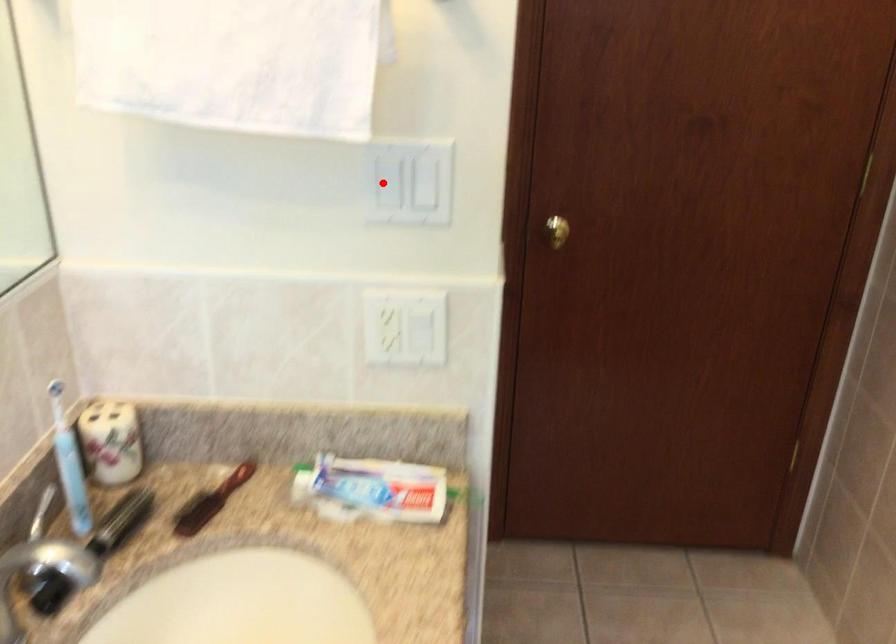
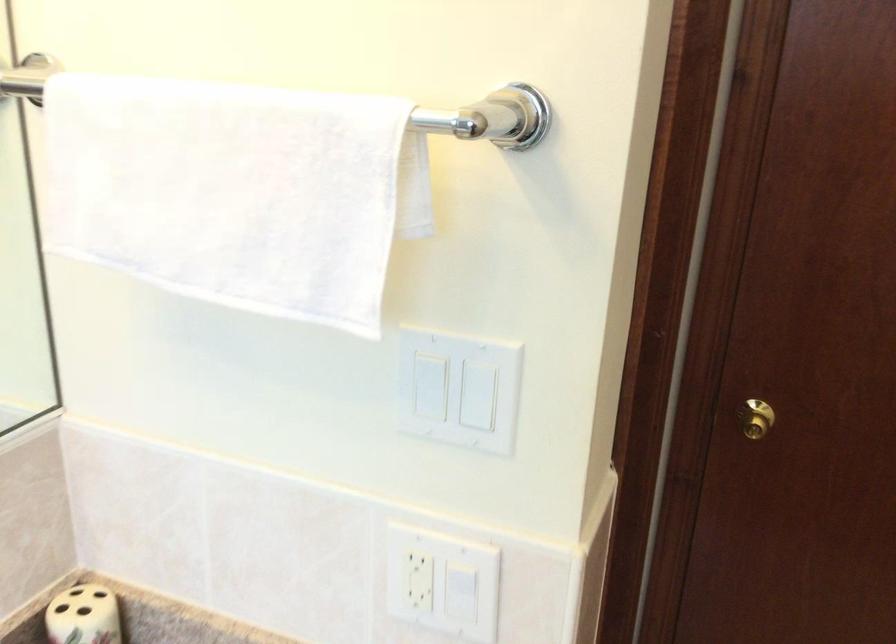
Question: I am providing you with two images of the same scene from different viewpoints. A red point is shown in image1. For the corresponding object point in image2, is it positioned nearer or farther from the camera?

Choices:
 (A) Nearer
 (B) Farther

Answer: (A)